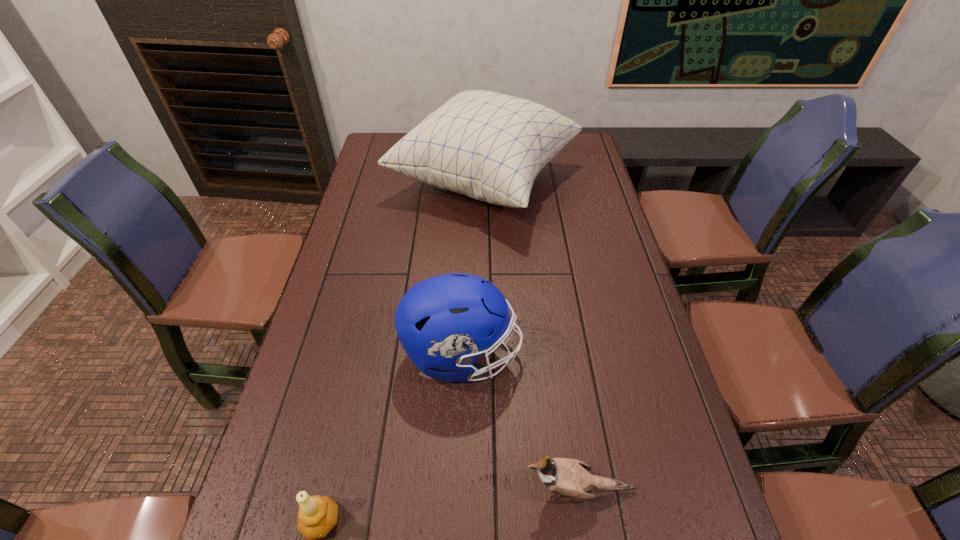
Identify the location of the tallest object. This screenshot has width=960, height=540. (488, 146).

At what (x,y) coordinates should I click in order to perform the action: click on the farthest object. Please return your answer as a coordinate pair (x, y). Image resolution: width=960 pixels, height=540 pixels. Looking at the image, I should click on 488,146.

Locate an element on the screen. The image size is (960, 540). football helmet is located at coordinates (446, 322).

At what (x,y) coordinates should I click in order to perform the action: click on the second farthest object. Please return your answer as a coordinate pair (x, y). The image size is (960, 540). Looking at the image, I should click on (446, 322).

The width and height of the screenshot is (960, 540). I want to click on bird, so click(569, 478).

Locate an element on the screen. The width and height of the screenshot is (960, 540). free location located 0.060m on the left of the tallest object is located at coordinates (373, 181).

The image size is (960, 540). In order to click on vacant space located on the front-facing side of the football helmet in this screenshot , I will do `click(655, 355)`.

Locate an element on the screen. The width and height of the screenshot is (960, 540). vacant space situated at the face of the bird is located at coordinates (392, 489).

This screenshot has width=960, height=540. Find the location of `vacant position located 0.380m at the face of the bird`. vacant position located 0.380m at the face of the bird is located at coordinates (331, 489).

You are a GUI agent. You are given a task and a screenshot of the screen. Output one action in this format:
    pyautogui.click(x=<x>, y=<y>)
    Task: Click on the vacant space located at the face of the bird
    The image size is (960, 540).
    Given the screenshot: What is the action you would take?
    pyautogui.click(x=396, y=489)